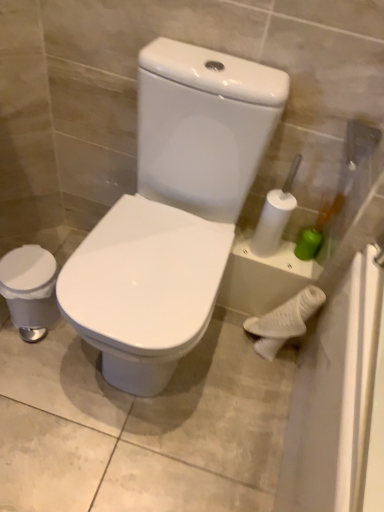
Question: Is point (284, 315) positioned closer to the camera than point (163, 245)?

Choices:
 (A) farther
 (B) closer

Answer: (A)

Question: Looking at their shapes, would you say white matte porcelain at lower right, marked as the 3th porcelain in a left-to-right arrangement, is wider or thinner than white glossy toilet at center, arranged as the 2th porcelain when viewed from the right?

Choices:
 (A) wide
 (B) thin

Answer: (B)

Question: Considering the real-world distances, which object is closest to the white matte porcelain at lower right, acting as the 1th porcelain starting from the right?

Choices:
 (A) white glossy toilet at center, placed as the second porcelain when sorted from left to right
 (B) white glossy trash can at left, the 1th porcelain in the left-to-right sequence

Answer: (A)

Question: Which is farther from the white matte porcelain at lower right, marked as the 3th porcelain in a left-to-right arrangement?

Choices:
 (A) white glossy trash can at left, the 1th porcelain in the left-to-right sequence
 (B) white glossy toilet at center, placed as the second porcelain when sorted from left to right

Answer: (A)